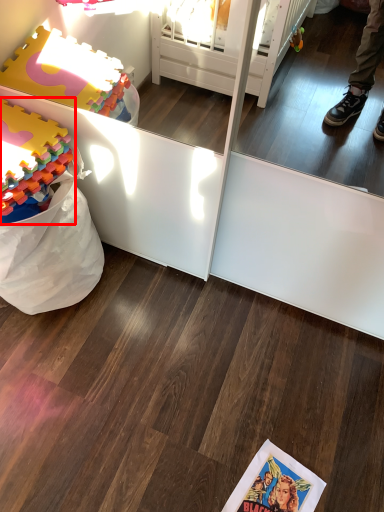
Question: From the image's perspective, where is toy (annotated by the red box) located in relation to comic book in the image?

Choices:
 (A) below
 (B) above

Answer: (B)